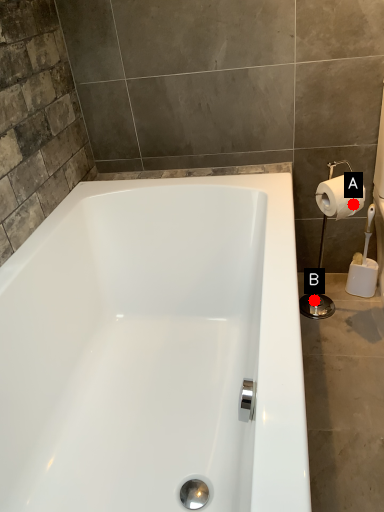
Question: Two points are circled on the image, labeled by A and B beside each circle. Which point is farther to the camera?

Choices:
 (A) A is further
 (B) B is further

Answer: (B)